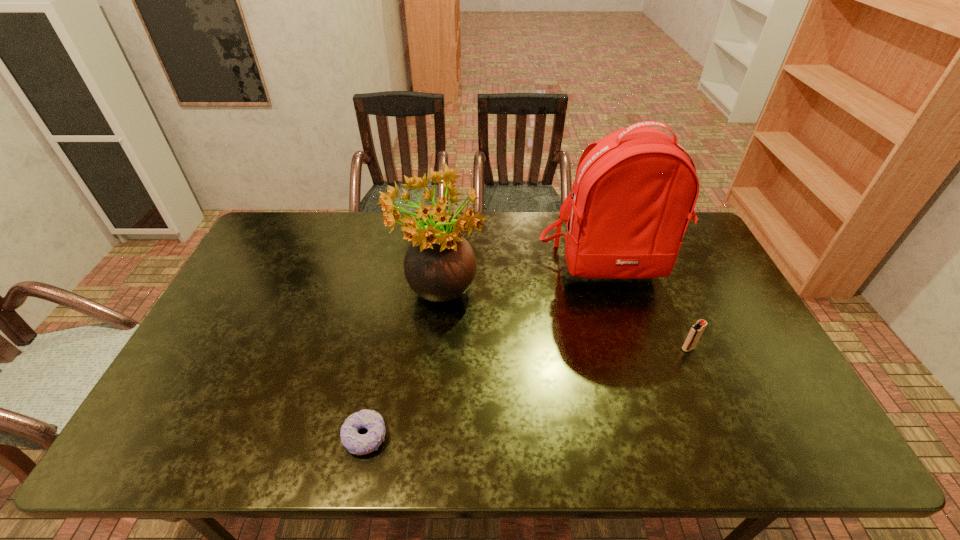
The width and height of the screenshot is (960, 540). I want to click on object that is at the far edge, so click(x=635, y=190).

You are a GUI agent. You are given a task and a screenshot of the screen. Output one action in this format:
    pyautogui.click(x=<x>, y=<y>)
    Task: Click on the object located in the near edge section of the desktop
    
    Given the screenshot: What is the action you would take?
    pyautogui.click(x=355, y=443)

Find the location of a particular element. object situated at the right edge is located at coordinates (635, 190).

At what (x,y) coordinates should I click in order to perform the action: click on object that is at the far right corner. Please return your answer as a coordinate pair (x, y). The height and width of the screenshot is (540, 960). Looking at the image, I should click on (635, 190).

Identify the location of free spot at the far edge of the desktop. (331, 244).

In the image, there is a desktop. Where is `free region at the near edge`? Image resolution: width=960 pixels, height=540 pixels. free region at the near edge is located at coordinates (264, 450).

The image size is (960, 540). In order to click on free space at the left edge of the desktop in this screenshot , I will do `click(218, 319)`.

This screenshot has height=540, width=960. Find the location of `blank space at the right edge of the desktop`. blank space at the right edge of the desktop is located at coordinates (728, 381).

Locate an element on the screen. vacant area at the far left corner of the desktop is located at coordinates (311, 225).

The height and width of the screenshot is (540, 960). Find the location of `empty space that is in between the second nearest object and the backpack`. empty space that is in between the second nearest object and the backpack is located at coordinates (648, 308).